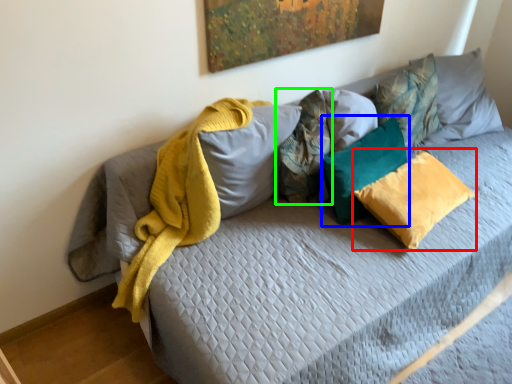
Question: Considering the real-world distances, which object is closest to pillow (highlighted by a red box)? pillow (highlighted by a blue box) or pillow (highlighted by a green box).

Choices:
 (A) pillow
 (B) pillow

Answer: (A)